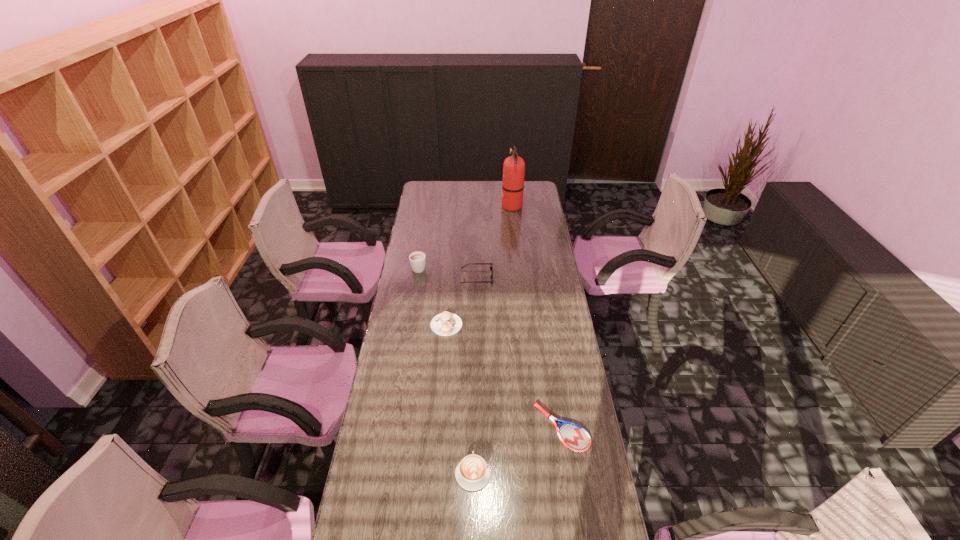
At what (x,y) coordinates should I click in order to perform the action: click on vacant region located on the side of the nearest object with the handle. Please return your answer as a coordinate pair (x, y). The width and height of the screenshot is (960, 540). Looking at the image, I should click on (473, 419).

You are a GUI agent. You are given a task and a screenshot of the screen. Output one action in this format:
    pyautogui.click(x=<x>, y=<y>)
    Task: Click on the free space located 0.230m on the front of the second shortest object
    
    Given the screenshot: What is the action you would take?
    click(442, 383)

This screenshot has width=960, height=540. In order to click on blank space located 0.360m on the back of the shortest object in this screenshot , I will do `click(547, 329)`.

You are a GUI agent. You are given a task and a screenshot of the screen. Output one action in this format:
    pyautogui.click(x=<x>, y=<y>)
    Task: Click on the object that is at the far edge
    
    Given the screenshot: What is the action you would take?
    pyautogui.click(x=514, y=166)

Locate an element on the screen. The height and width of the screenshot is (540, 960). object that is at the left edge is located at coordinates (417, 259).

At what (x,y) coordinates should I click in order to perform the action: click on fire extinguisher positioned at the right edge. Please return your answer as a coordinate pair (x, y). Looking at the image, I should click on click(x=514, y=166).

The image size is (960, 540). Find the location of `tennis racket situated at the right edge`. tennis racket situated at the right edge is located at coordinates (573, 436).

Where is `object positioned at the far right corner`? object positioned at the far right corner is located at coordinates (514, 166).

Where is `vacant space at the far edge of the desktop`? vacant space at the far edge of the desktop is located at coordinates tap(499, 185).

In the image, there is a desktop. Identify the location of vacant space at the left edge. This screenshot has height=540, width=960. (391, 392).